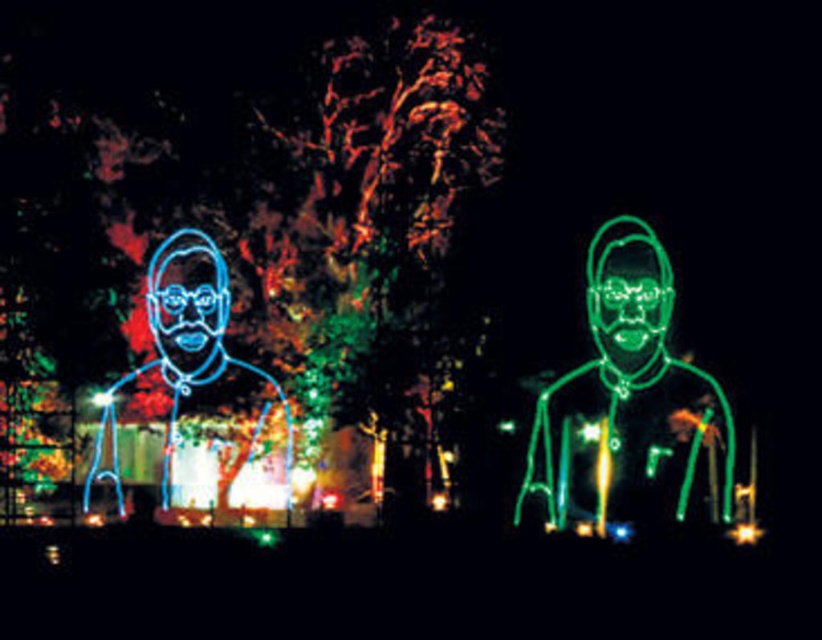
Which is below, neon green wireframe figure at center or neon blue face at left?

neon green wireframe figure at center is lower down.

Consider the image. Does neon green wireframe figure at center have a lesser width compared to neon blue face at left?

No.

The height and width of the screenshot is (640, 822). What are the coordinates of `neon green wireframe figure at center` in the screenshot? It's located at (622, 349).

Who is positioned more to the left, blue neon sign at left or neon green face at center?

blue neon sign at left

Which is behind, point (171, 460) or point (627, 278)?

The point (171, 460) is behind.

The image size is (822, 640). Identify the location of blue neon sign at left. [181, 356].

Who is higher up, blue neon sign at left or neon blue face at left?

neon blue face at left is above.

Does blue neon sign at left appear on the left side of neon blue face at left?

Incorrect, blue neon sign at left is not on the left side of neon blue face at left.

Which is in front, point (174, 419) or point (169, 308)?

Positioned in front is point (174, 419).

Locate an element on the screen. The width and height of the screenshot is (822, 640). blue neon sign at left is located at coordinates (181, 356).